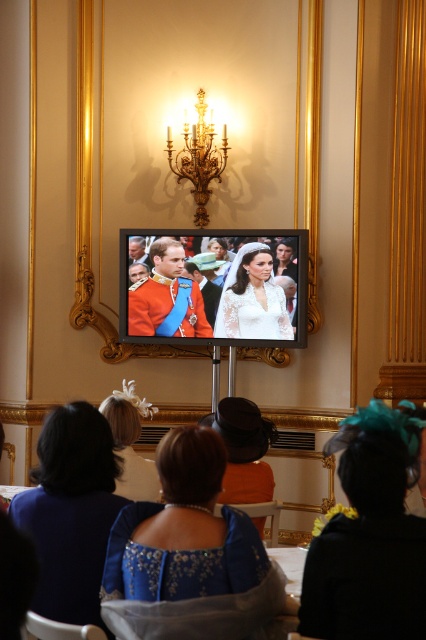
Please look at the television screen showing the two people. There is a point marked at coordinates [131,444]. What object is located at that point?

The point at [131,444] marks the location of the white feathered hat at center.

In the scene shown: You are planning to take a photo of the blue satin dress at lower center and the white feathered hat at center. Since you want to ensure both are clearly visible, which object should you focus on first to avoid blurriness due to their sizes?

The blue satin dress at lower center has a smaller size compared to the white feathered hat at center. Therefore, you should focus on the blue satin dress at lower center first because smaller objects require more precise focusing to avoid blurriness.